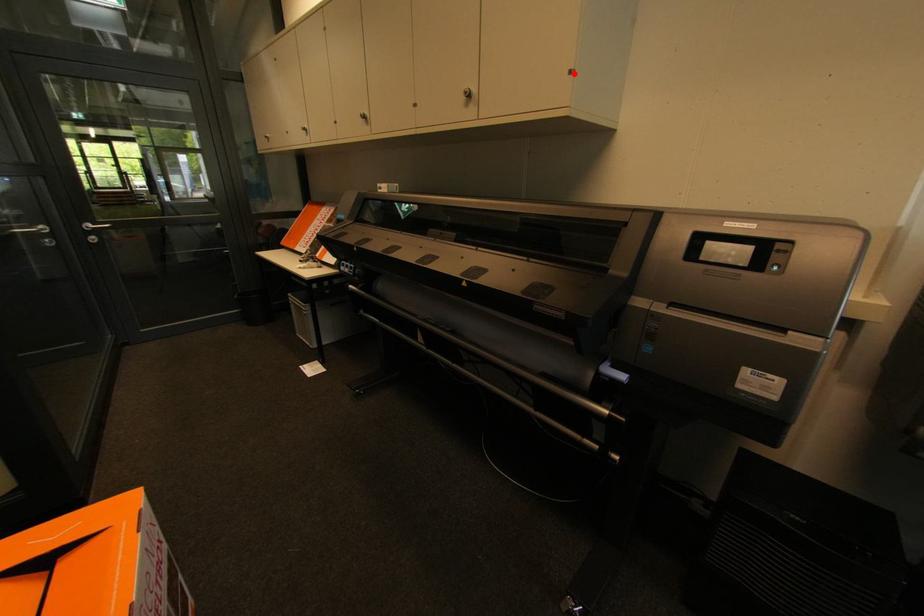
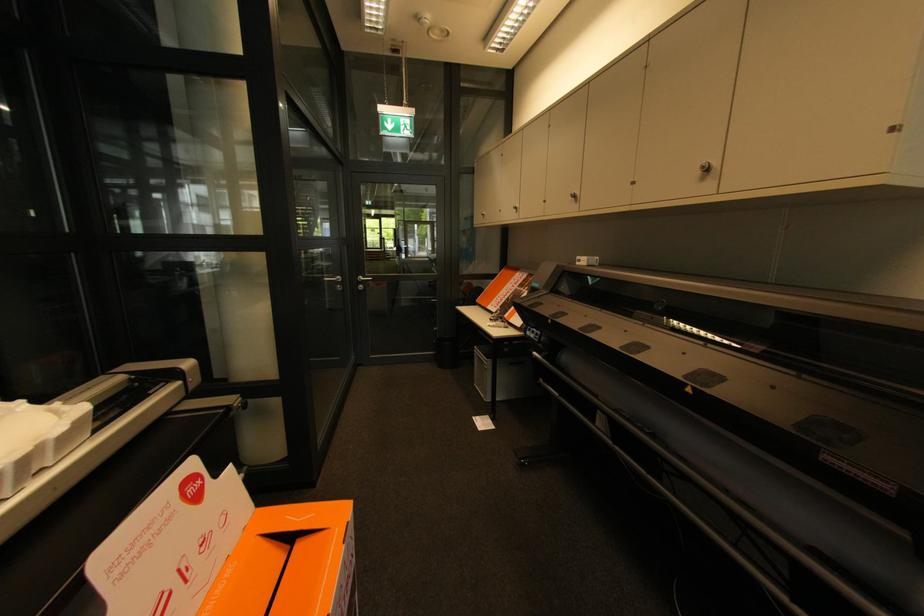
Find the pixel in the second image that matches the highlighted location in the first image.

(895, 130)